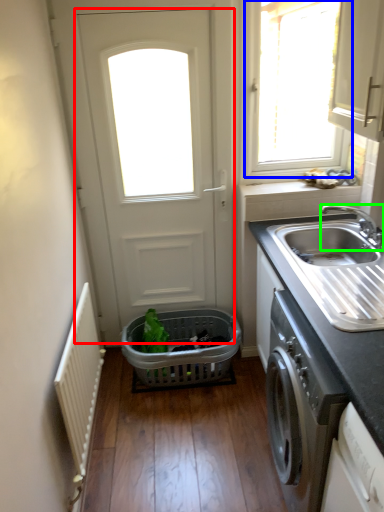
Question: Which is nearer to the door (highlighted by a red box)? window (highlighted by a blue box) or tap (highlighted by a green box).

Choices:
 (A) window
 (B) tap

Answer: (B)